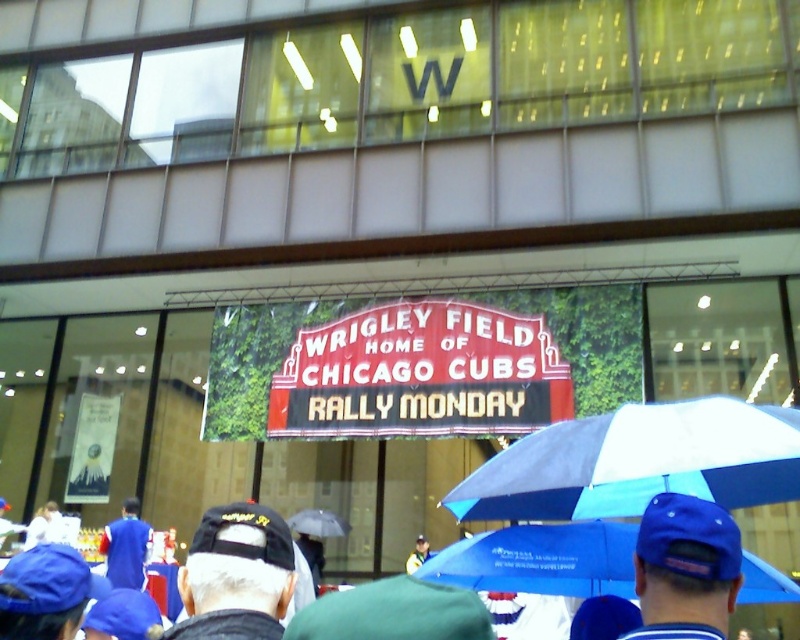
You are a photographer standing at the edge of the crowd. You want to take a photo of the blue fabric jacket at lower left without the blue fabric umbrella at lower center blocking it. Is the umbrella currently blocking the jacket?

The blue fabric umbrella at lower center is in front of the blue fabric jacket at lower left, so yes, the umbrella is currently blocking the jacket.

You are a photographer standing at the center of the crowd. You want to take a photo that includes both the blue fabric umbrella at center and the black fabric cap at lower left. How far apart are these two objects in feet?

The blue fabric umbrella at center is 5.53 feet from the black fabric cap at lower left, so the distance between them is 5.53 feet.

You are a photographer standing at the rally outside Wrigley Field. You want to take a photo of the black fabric cap at lower left without it being blocked by the blue fabric umbrella at center. Where should you move to get an unobstructed view?

Move to the right side of the blue fabric umbrella at center so that the black fabric cap at lower left comes into view, as it is currently behind the umbrella.